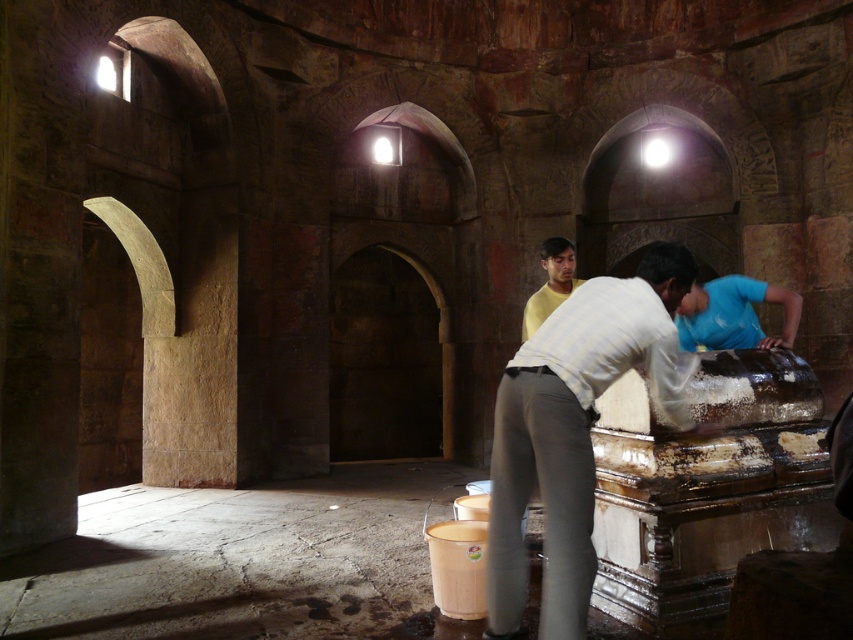
Between point (527, 362) and point (788, 291), which one is positioned in front?

Point (527, 362)

Who is taller, white matte shirt at center or blue cotton shirt at lower right?

white matte shirt at center is taller.

What do you see at coordinates (573, 432) in the screenshot? This screenshot has height=640, width=853. I see `white matte shirt at center` at bounding box center [573, 432].

Image resolution: width=853 pixels, height=640 pixels. In order to click on white matte shirt at center in this screenshot , I will do `click(573, 432)`.

How distant is blue cotton shirt at lower right from yellow matte shirt at center?

blue cotton shirt at lower right is 1.21 meters away from yellow matte shirt at center.

Can you confirm if blue cotton shirt at lower right is positioned to the right of yellow matte shirt at center?

Yes, blue cotton shirt at lower right is to the right of yellow matte shirt at center.

Locate an element on the screen. The image size is (853, 640). blue cotton shirt at lower right is located at coordinates (733, 314).

Can you confirm if white matte shirt at center is taller than yellow matte shirt at center?

Correct, white matte shirt at center is much taller as yellow matte shirt at center.

Is white matte shirt at center behind yellow matte shirt at center?

No, it is not.

Which is in front, point (531, 452) or point (531, 332)?

Point (531, 452) is more forward.

The image size is (853, 640). In order to click on white matte shirt at center in this screenshot , I will do `click(573, 432)`.